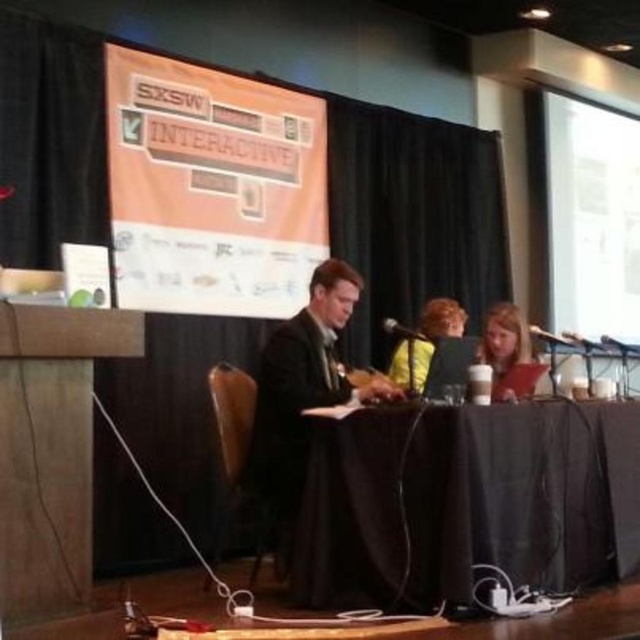
Between point (330, 260) and point (524, 332), which one is positioned in front?

Point (330, 260)

Is matte black suit at center bigger than blonde hair at center?

Correct, matte black suit at center is larger in size than blonde hair at center.

Who is more distant from viewer, [259,435] or [493,360]?

Point [493,360]

In order to click on matte black suit at center in this screenshot , I will do `click(301, 396)`.

Can you confirm if orange fabric banner at upper center is bigger than white matte projection screen at upper right?

No, orange fabric banner at upper center is not bigger than white matte projection screen at upper right.

Does orange fabric banner at upper center lie in front of white matte projection screen at upper right?

Yes, it is.

Find the location of a particular element. orange fabric banner at upper center is located at coordinates (211, 188).

Who is more distant from viewer, (284, 436) or (426, 337)?

Point (426, 337)

Does point (324, 321) lie behind point (396, 356)?

No, it is not.

Where is `matte black suit at center`? The image size is (640, 640). matte black suit at center is located at coordinates (301, 396).